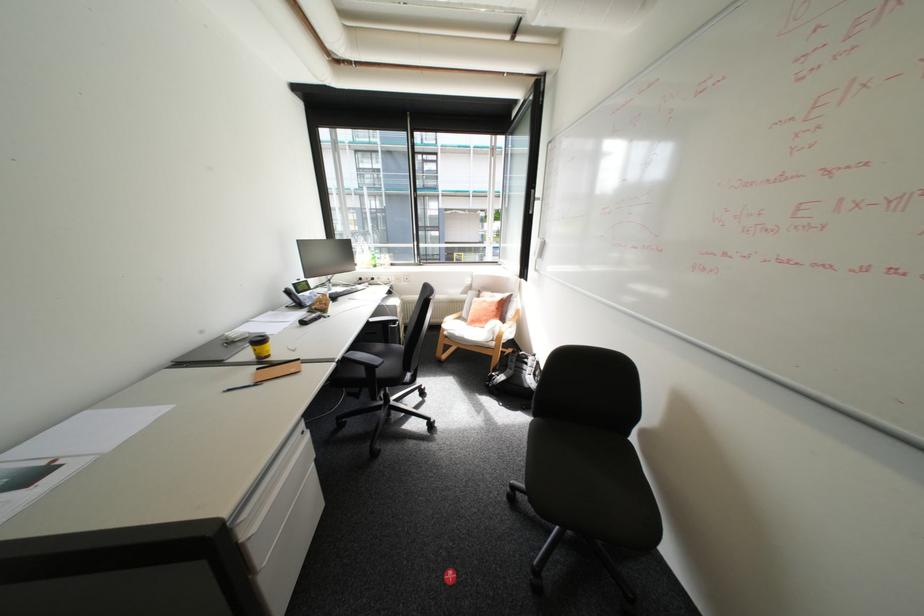
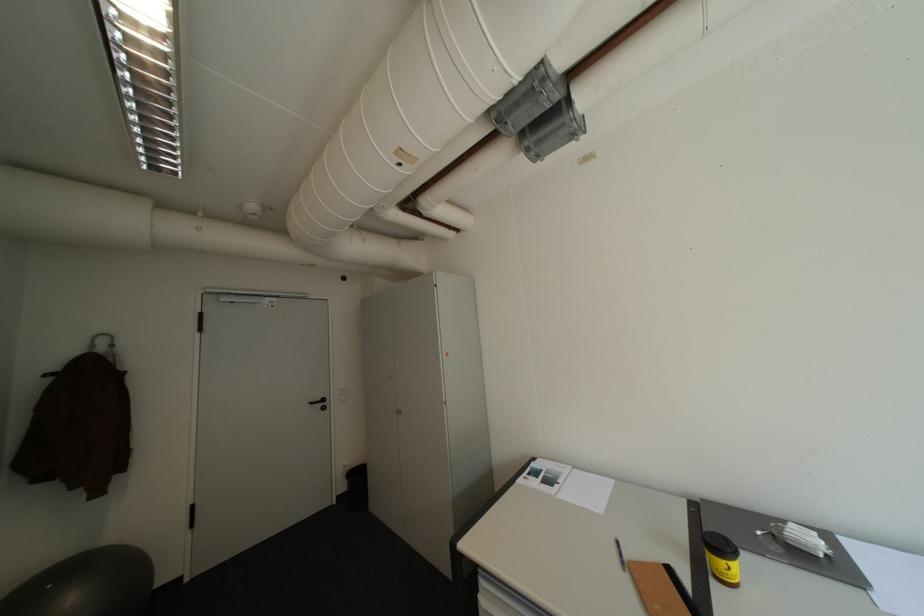
Find the pixel in the second image that matches point (271, 384) in the first image.

(634, 570)